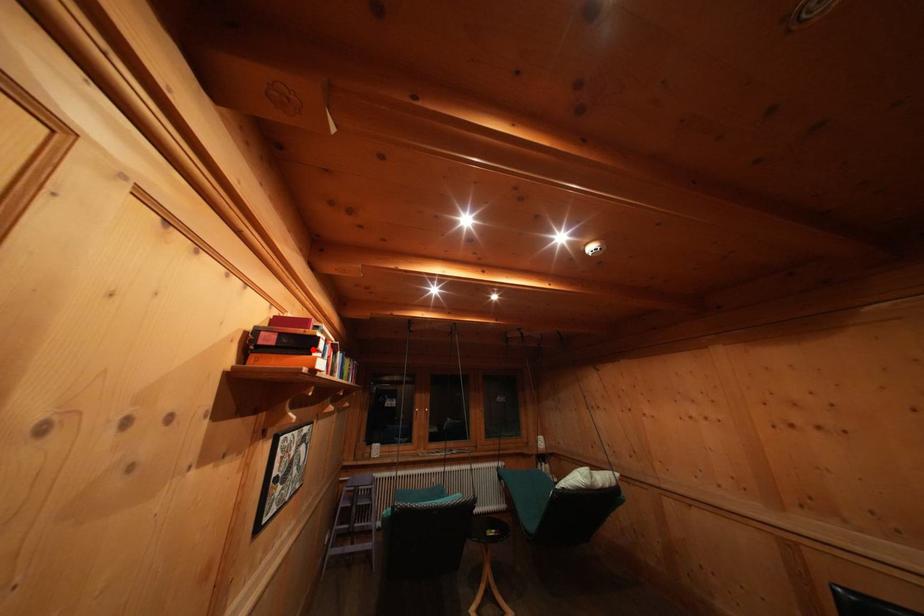
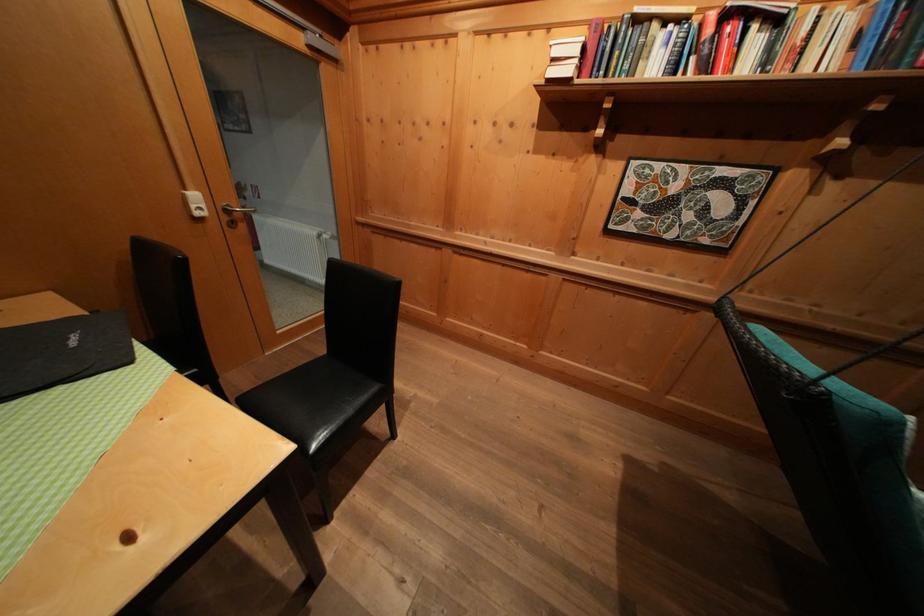
Question: I am providing you with two images of the same scene from different viewpoints. A red point is marked on the first image. Is the red point's position out of view in image 2?

Choices:
 (A) Yes
 (B) No

Answer: (A)